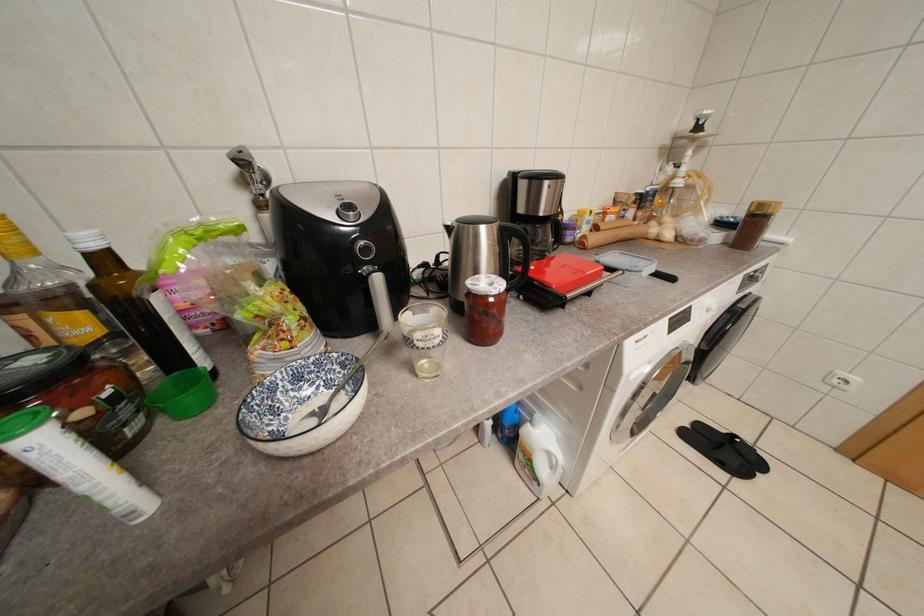
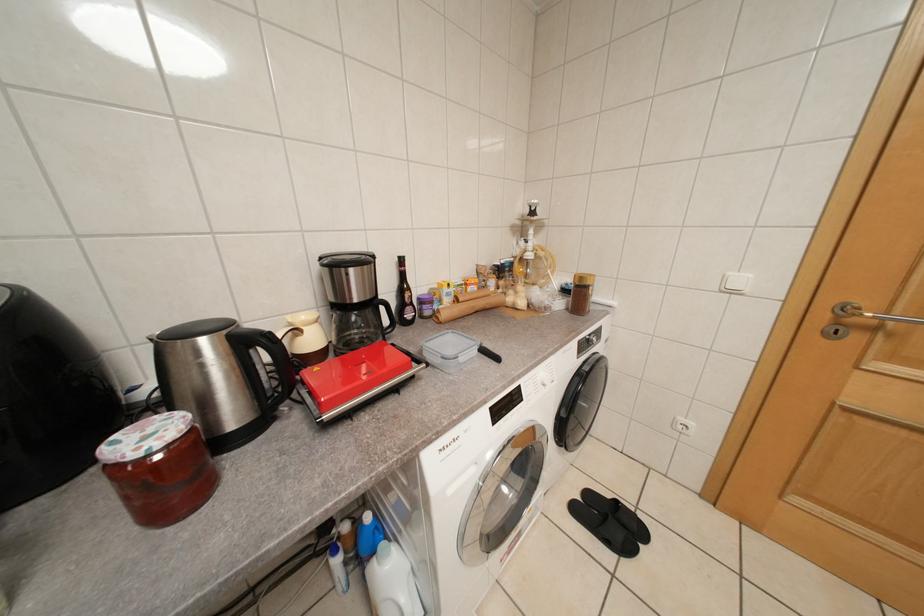
Question: The camera is either moving clockwise (left) or counter-clockwise (right) around the object. The first image is from the beginning of the video and the second image is from the end. Is the camera moving left or right when shooting the video?

Choices:
 (A) Left
 (B) Right

Answer: (A)